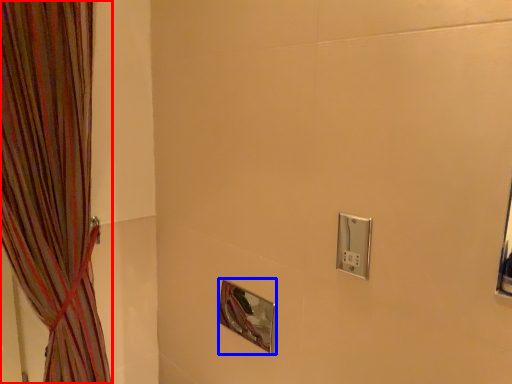
Question: Among these objects, which one is nearest to the camera, curtain (highlighted by a red box) or mirror (highlighted by a blue box)?

Choices:
 (A) curtain
 (B) mirror

Answer: (A)